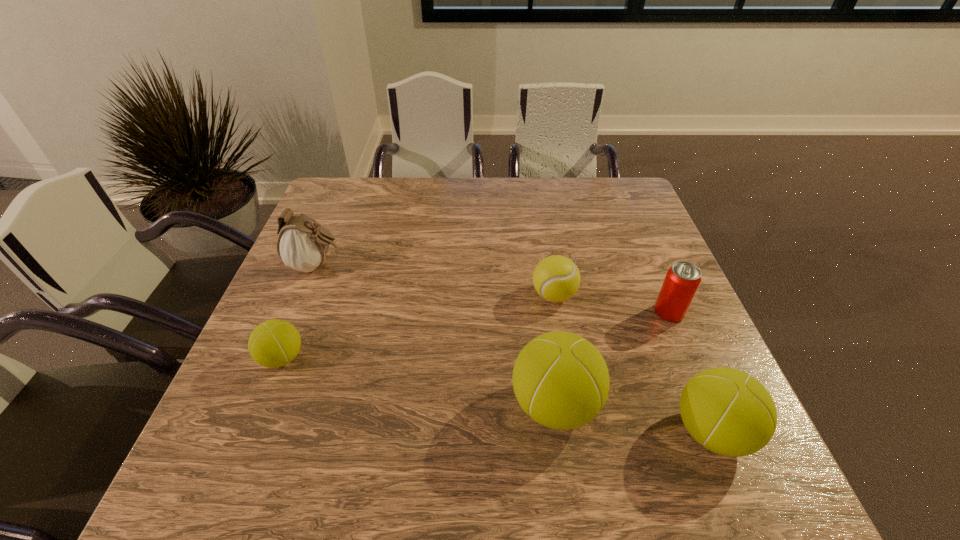
Identify the location of tennis ball that is at the left edge. (274, 343).

Find the location of a particular element. Image resolution: width=960 pixels, height=540 pixels. pouch that is at the left edge is located at coordinates (302, 245).

Where is `tennis ball that is at the right edge`? tennis ball that is at the right edge is located at coordinates (731, 413).

I want to click on can at the right edge, so click(682, 280).

Locate an element on the screen. object located at the near right corner is located at coordinates (731, 413).

Find the location of a particular element. The image size is (960, 540). vacant space at the far edge of the desktop is located at coordinates (450, 195).

You are a GUI agent. You are given a task and a screenshot of the screen. Output one action in this format:
    pyautogui.click(x=<x>, y=<y>)
    Task: Click on the free space at the near edge
    This screenshot has width=960, height=540.
    Given the screenshot: What is the action you would take?
    pyautogui.click(x=394, y=419)

This screenshot has height=540, width=960. Find the location of `free space at the left edge`. free space at the left edge is located at coordinates (339, 254).

Image resolution: width=960 pixels, height=540 pixels. What are the coordinates of `vacant space at the right edge of the desktop` in the screenshot? It's located at (632, 274).

Identify the location of free spot at the far left corner of the desktop. (317, 216).